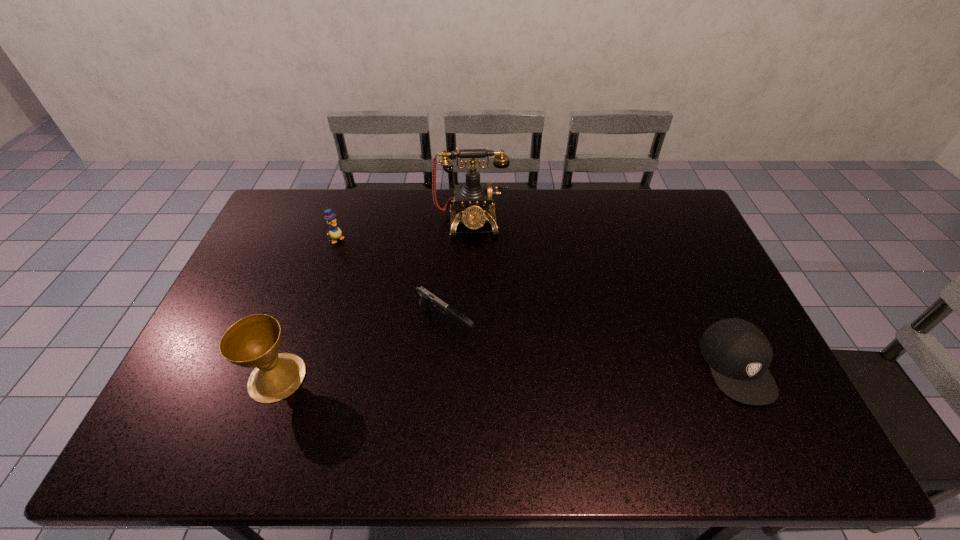
Identify the location of free space between the second tallest object and the cap. (507, 372).

I want to click on free space between the duckling and the cap, so click(x=537, y=302).

Where is `vacant area that lies between the duckling and the cap`? vacant area that lies between the duckling and the cap is located at coordinates (537, 302).

Image resolution: width=960 pixels, height=540 pixels. I want to click on free space that is in between the telephone and the shortest object, so click(458, 272).

Image resolution: width=960 pixels, height=540 pixels. In order to click on empty location between the second tallest object and the telephone in this screenshot , I will do `click(374, 300)`.

Identify the location of vacant area that lies between the chalice and the rightmost object. (507, 372).

You are a GUI agent. You are given a task and a screenshot of the screen. Output one action in this format:
    pyautogui.click(x=<x>, y=<y>)
    Task: Click on the second closest object to the telephone
    
    Given the screenshot: What is the action you would take?
    pyautogui.click(x=335, y=232)

Identify which object is the third closest to the shortest object. Please provide its 2D coordinates. Your answer should be formatted as a tuple, i.e. [(x, y)], where the tuple contains the x and y coordinates of a point satisfying the conditions above.

[(335, 232)]